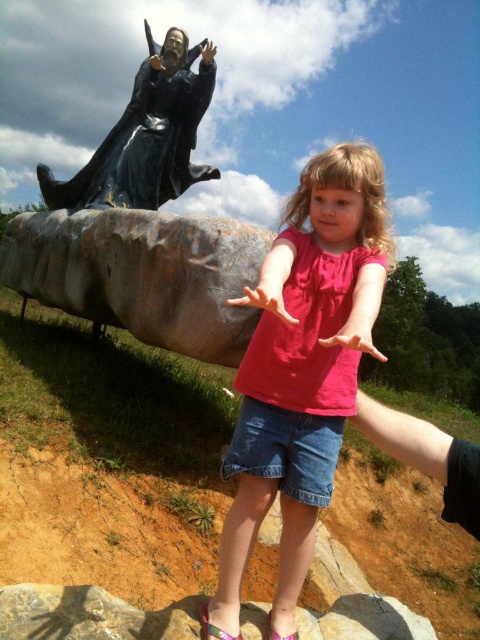
Question: Does pink matte hand at center have a greater width compared to matte pink hand at center?

Choices:
 (A) no
 (B) yes

Answer: (A)

Question: Is pink cotton shirt at center bigger than black matte statue at upper left?

Choices:
 (A) no
 (B) yes

Answer: (A)

Question: Among these points, which one is nearest to the camera?

Choices:
 (A) click(x=78, y=177)
 (B) click(x=368, y=252)
 (C) click(x=280, y=305)
 (D) click(x=141, y=272)

Answer: (C)

Question: Does black matte statue at upper left lie in front of black polished statue at upper left?

Choices:
 (A) yes
 (B) no

Answer: (A)

Question: Which of the following is the closest to the observer?

Choices:
 (A) (213, 45)
 (B) (156, 93)
 (C) (275, 292)

Answer: (C)

Question: Which point is closer to the camera?

Choices:
 (A) pink matte hand at center
 (B) black matte statue at upper left

Answer: (A)